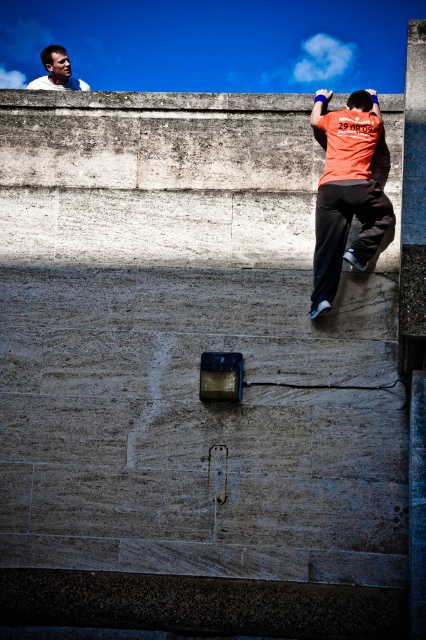
Between orange matte shirt at upper right and white shirt at upper left, which one has less height?

With less height is orange matte shirt at upper right.

Is orange matte shirt at upper right shorter than white shirt at upper left?

Yes, orange matte shirt at upper right is shorter than white shirt at upper left.

Between point (340, 120) and point (78, 88), which one is positioned behind?

The point (78, 88) is behind.

Find the location of a particular element. Image resolution: width=426 pixels, height=640 pixels. orange matte shirt at upper right is located at coordinates (347, 193).